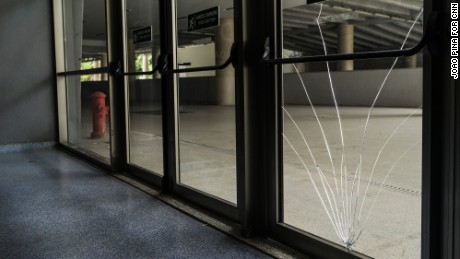
You are a GUI agent. You are given a task and a screenshot of the screen. Output one action in this format:
    pyautogui.click(x=<x>, y=<y>)
    Task: Click on the door frame
    
    Given the screenshot: What is the action you would take?
    pyautogui.click(x=269, y=175), pyautogui.click(x=446, y=170), pyautogui.click(x=243, y=138), pyautogui.click(x=170, y=126), pyautogui.click(x=123, y=117), pyautogui.click(x=52, y=96)